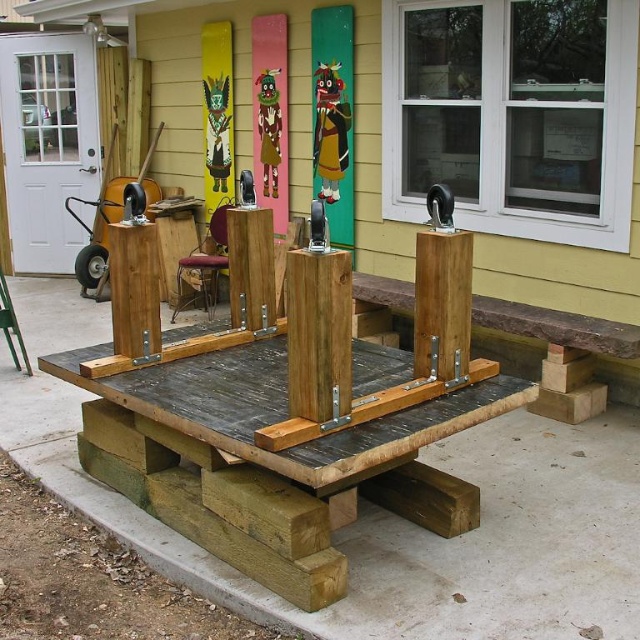
Question: Among these objects, which one is nearest to the camera?

Choices:
 (A) weathered wood bench at center
 (B) brown wooden post at center
 (C) velvet red stool at center

Answer: (B)

Question: In this image, where is weathered wood bench at center located relative to brown wooden post at center?

Choices:
 (A) below
 (B) above

Answer: (A)

Question: Does brown wooden post at center appear under velvet red stool at center?

Choices:
 (A) yes
 (B) no

Answer: (A)

Question: Which point is closer to the camera?

Choices:
 (A) (177, 260)
 (B) (125, 291)

Answer: (B)

Question: Can you confirm if brown wooden post at center is positioned to the left of velvet red stool at center?

Choices:
 (A) no
 (B) yes

Answer: (A)

Question: Which object is closer to the camera taking this photo?

Choices:
 (A) weathered wood bench at center
 (B) velvet red stool at center
 (C) brown wooden post at center

Answer: (C)